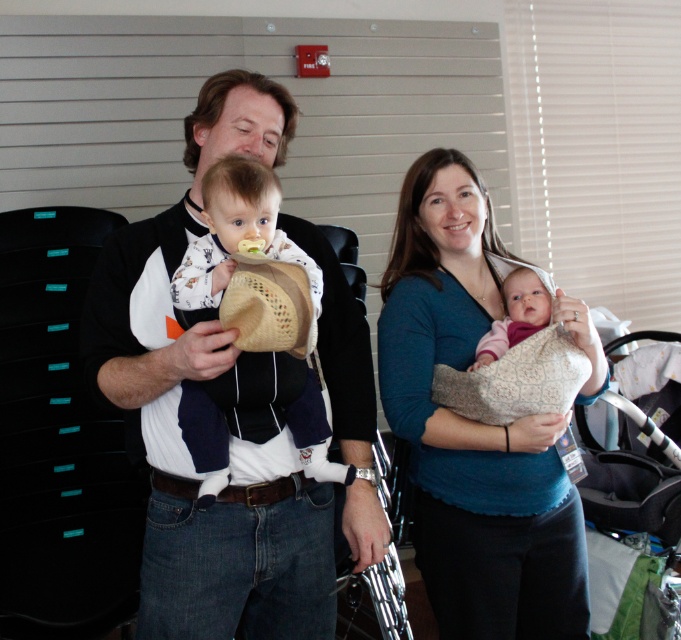
Between point (518, 605) and point (548, 298), which one is positioned in front?

Point (548, 298) is more forward.

Who is more forward, (558, 518) or (498, 326)?

Point (498, 326)

Where is `blue soft fabric baby carrier at center`? blue soft fabric baby carrier at center is located at coordinates (473, 426).

The width and height of the screenshot is (681, 640). Describe the element at coordinates (225, 412) in the screenshot. I see `white cotton shirt at center` at that location.

At what (x,y) coordinates should I click in order to perform the action: click on white cotton shirt at center. Please return your answer as a coordinate pair (x, y). The image size is (681, 640). Looking at the image, I should click on (225, 412).

Between blue soft fabric baby carrier at center and white cotton baby at center, which one is positioned lower?

Positioned lower is blue soft fabric baby carrier at center.

This screenshot has width=681, height=640. What do you see at coordinates (473, 426) in the screenshot? I see `blue soft fabric baby carrier at center` at bounding box center [473, 426].

You are a GUI agent. You are given a task and a screenshot of the screen. Output one action in this format:
    pyautogui.click(x=<x>, y=<y>)
    Task: Click on the blue soft fabric baby carrier at center
    The height and width of the screenshot is (640, 681).
    Given the screenshot: What is the action you would take?
    pyautogui.click(x=473, y=426)